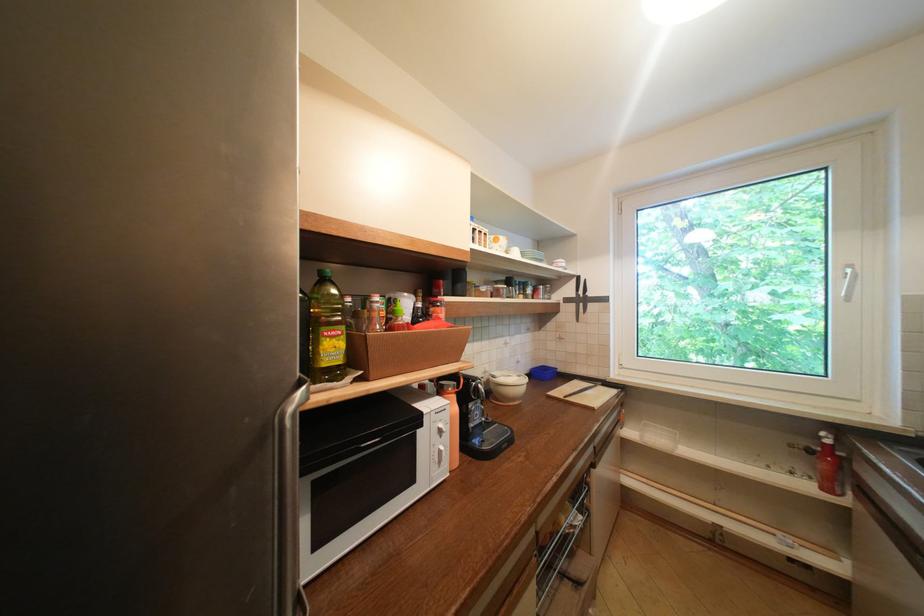
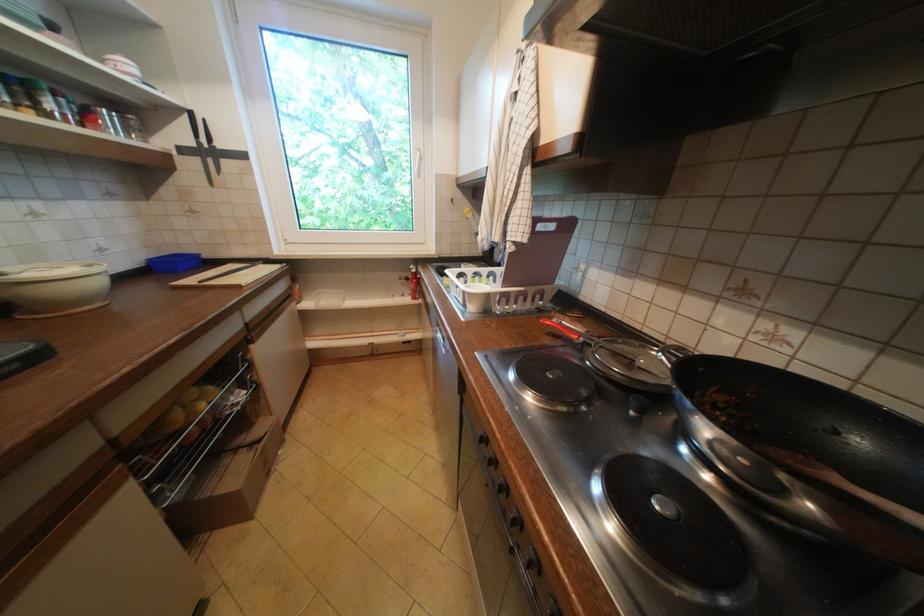
In the second image, find the point that corresponds to point 526,377 in the first image.

(91, 267)